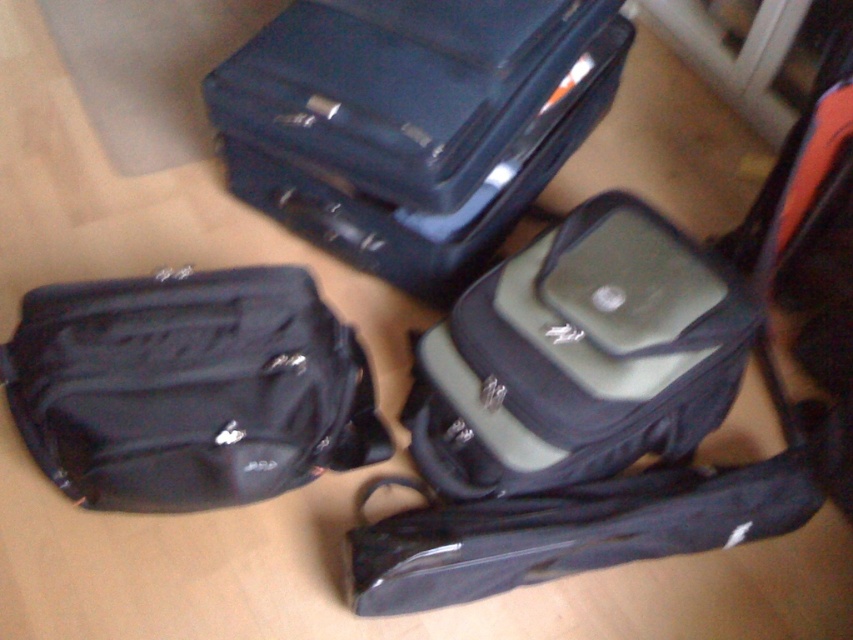
Can you confirm if matte black suitcase at upper center is bigger than green fabric laptop case at center?

Correct, matte black suitcase at upper center is larger in size than green fabric laptop case at center.

Is matte black suitcase at upper center to the left of green fabric laptop case at center from the viewer's perspective?

Indeed, matte black suitcase at upper center is positioned on the left side of green fabric laptop case at center.

Between point (561, 132) and point (695, 301), which one is positioned in front?

Positioned in front is point (695, 301).

This screenshot has width=853, height=640. What are the coordinates of `matte black suitcase at upper center` in the screenshot? It's located at (413, 122).

Consider the image. Does matte black suitcase at upper center have a lesser height compared to black fabric bag at lower left?

No.

Who is shorter, matte black suitcase at upper center or black fabric bag at lower left?

black fabric bag at lower left

Who is more distant from viewer, (386,208) or (187,499)?

The point (386,208) is behind.

The height and width of the screenshot is (640, 853). I want to click on matte black suitcase at upper center, so click(413, 122).

Based on the photo, can you confirm if black fabric bag at lower left is wider than green fabric laptop case at center?

Yes.

Which is behind, point (189, 488) or point (521, 371)?

The point (521, 371) is more distant.

You are a GUI agent. You are given a task and a screenshot of the screen. Output one action in this format:
    pyautogui.click(x=<x>, y=<y>)
    Task: Click on the black fabric bag at lower left
    The width and height of the screenshot is (853, 640).
    Given the screenshot: What is the action you would take?
    pyautogui.click(x=189, y=388)